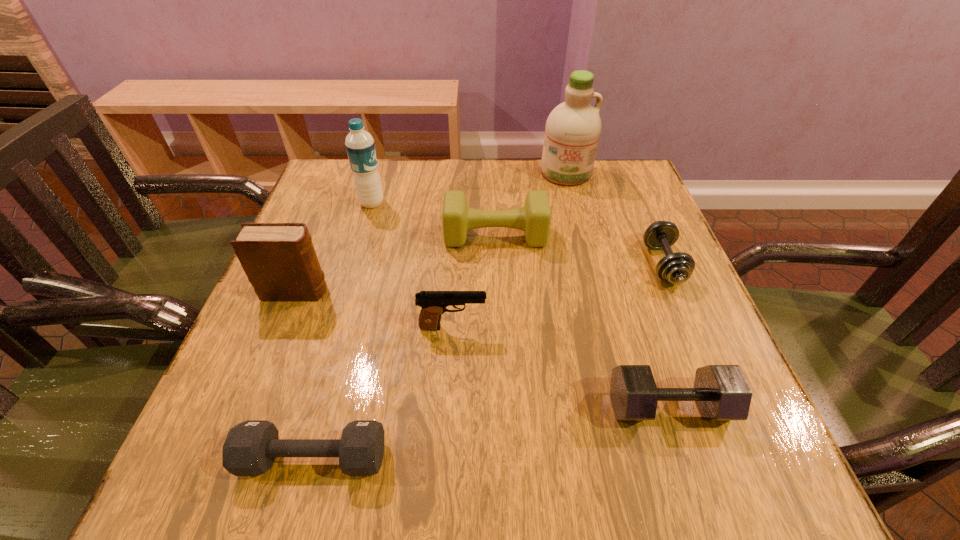
Where is `free region at the right edge of the desktop`? free region at the right edge of the desktop is located at coordinates (649, 211).

In the image, there is a desktop. Identify the location of vacant space at the far left corner. (378, 163).

Locate an element on the screen. The width and height of the screenshot is (960, 540). vacant space at the near right corner is located at coordinates (756, 491).

The height and width of the screenshot is (540, 960). I want to click on blank region between the second dumbbell from left to right and the second nearest object, so click(x=582, y=321).

Where is `free space between the tallest object and the third farthest dumbbell`? This screenshot has width=960, height=540. free space between the tallest object and the third farthest dumbbell is located at coordinates (617, 289).

The width and height of the screenshot is (960, 540). I want to click on free space between the cleansing agent and the sixth farthest object, so click(x=509, y=250).

Image resolution: width=960 pixels, height=540 pixels. Find the location of `free spot between the sixth farthest object and the leftmost dumbbell`. free spot between the sixth farthest object and the leftmost dumbbell is located at coordinates (383, 393).

At what (x,y) coordinates should I click in order to perform the action: click on free spot between the cleansing agent and the diary. Please return your answer as a coordinate pair (x, y). The image size is (960, 540). Looking at the image, I should click on (431, 232).

At what (x,y) coordinates should I click in order to perform the action: click on free space between the sixth shortest object and the water bottle. Please return your answer as a coordinate pair (x, y). Image resolution: width=960 pixels, height=540 pixels. Looking at the image, I should click on (334, 247).

This screenshot has height=540, width=960. Identify the location of unoccupied area between the pistol and the third tallest object. (374, 309).